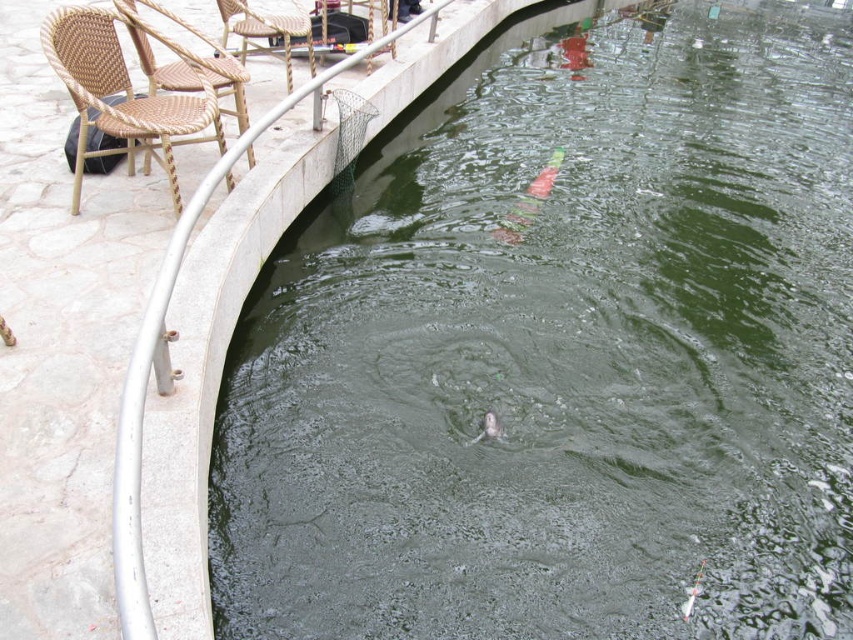
Between woven rattan chair at upper left and shiny pink fish at center, which one has less height?

woven rattan chair at upper left

Image resolution: width=853 pixels, height=640 pixels. Describe the element at coordinates (186, 61) in the screenshot. I see `woven rattan chair at upper left` at that location.

Where is `woven rattan chair at upper left`? The image size is (853, 640). woven rattan chair at upper left is located at coordinates 186,61.

Is shiny pink fish at center thinner than shiny silver fish at center?

No.

Does shiny pink fish at center come in front of shiny silver fish at center?

No, shiny pink fish at center is behind shiny silver fish at center.

This screenshot has height=640, width=853. I want to click on shiny pink fish at center, so click(x=529, y=202).

Who is higher up, woven wicker chair at upper left or shiny silver fish at center?

Positioned higher is woven wicker chair at upper left.

How far apart are woven wicker chair at upper left and shiny silver fish at center?

woven wicker chair at upper left and shiny silver fish at center are 4.40 meters apart.

Which is behind, point (302, 33) or point (498, 433)?

Point (302, 33)

Image resolution: width=853 pixels, height=640 pixels. Find the location of `woven wicker chair at upper left`. woven wicker chair at upper left is located at coordinates click(265, 33).